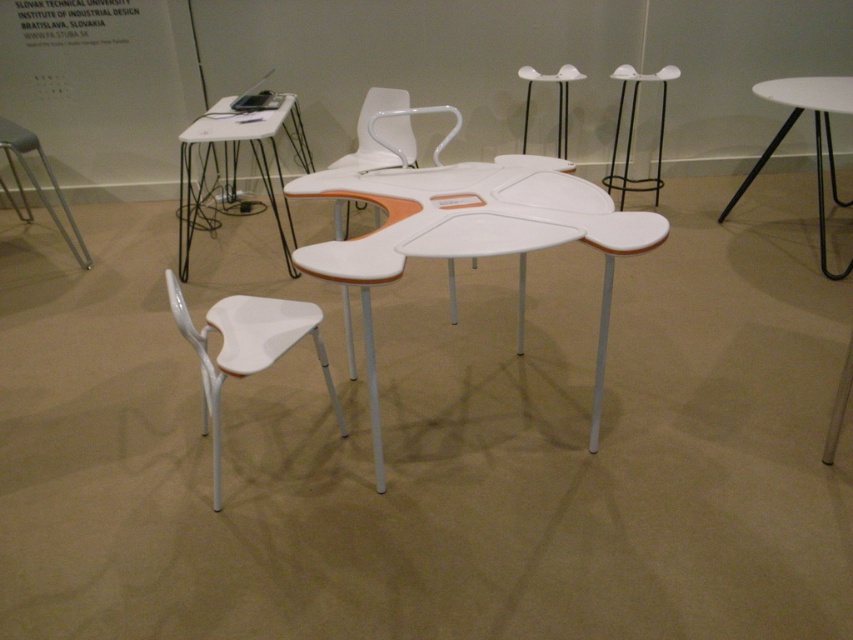
Question: Which object is closer to the camera taking this photo?

Choices:
 (A) white plastic chair at lower left
 (B) white glossy table at center
 (C) white plastic stool at upper center

Answer: (B)

Question: Which point is farther from the camera taking this photo?

Choices:
 (A) (369, 161)
 (B) (566, 81)

Answer: (B)

Question: Does white glossy table at center have a greater width compared to white plastic chair at lower left?

Choices:
 (A) yes
 (B) no

Answer: (A)

Question: In this image, where is white plastic chair at lower left located relative to white glossy table at upper right?

Choices:
 (A) right
 (B) left

Answer: (B)

Question: Can you confirm if black metal stool at upper right is positioned to the right of metallic silver stool at left?

Choices:
 (A) no
 (B) yes

Answer: (B)

Question: Which point is closer to the camera?

Choices:
 (A) (241, 294)
 (B) (799, 84)

Answer: (A)